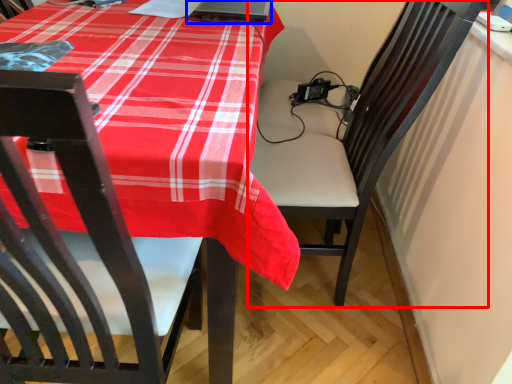
Question: Which of the following is the farthest to the observer, chair (highlighted by a red box) or laptop (highlighted by a blue box)?

Choices:
 (A) chair
 (B) laptop

Answer: (B)